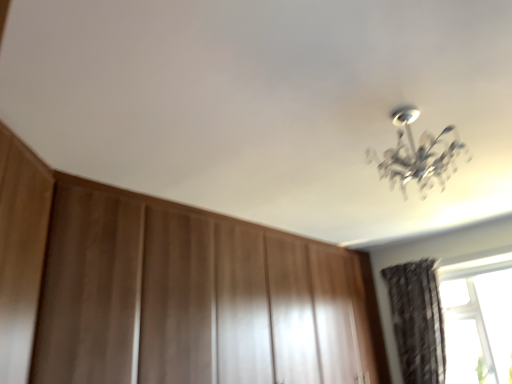
What do you see at coordinates (188, 295) in the screenshot? I see `wooden dresser at center` at bounding box center [188, 295].

The height and width of the screenshot is (384, 512). I want to click on wooden dresser at center, so click(188, 295).

Measure the distance between point (x=423, y=342) and camera.

The depth of point (x=423, y=342) is 11.53 feet.

Image resolution: width=512 pixels, height=384 pixels. Identify the location of dark textured curtain at lower right. 417,320.

What do you see at coordinates (417, 320) in the screenshot? I see `dark textured curtain at lower right` at bounding box center [417, 320].

Identify the location of wooden dresser at center. Image resolution: width=512 pixels, height=384 pixels. (188, 295).

Visually, is dark textured curtain at lower right positioned to the left or to the right of wooden dresser at center?

Based on their positions, dark textured curtain at lower right is located to the right of wooden dresser at center.

In the image, is dark textured curtain at lower right positioned in front of or behind wooden dresser at center?

dark textured curtain at lower right is positioned farther from the viewer than wooden dresser at center.

Is point (406, 271) closer to camera compared to point (47, 250)?

No, (406, 271) is behind (47, 250).

From the image's perspective, which is above, dark textured curtain at lower right or wooden dresser at center?

wooden dresser at center appears higher in the image.

From a real-world perspective, relative to wooden dresser at center, is dark textured curtain at lower right vertically above or below?

dark textured curtain at lower right is below wooden dresser at center.

Which of these two, dark textured curtain at lower right or wooden dresser at center, is wider?

wooden dresser at center.

Does dark textured curtain at lower right have a greater height compared to wooden dresser at center?

Incorrect, the height of dark textured curtain at lower right is not larger of that of wooden dresser at center.

Between dark textured curtain at lower right and wooden dresser at center, which one has larger size?

With larger size is wooden dresser at center.

Choose the correct answer: Is dark textured curtain at lower right inside wooden dresser at center or outside it?

dark textured curtain at lower right is contained in wooden dresser at center.

Is dark textured curtain at lower right positioned far away from wooden dresser at center?

Yes, dark textured curtain at lower right and wooden dresser at center are located far from each other.

Does dark textured curtain at lower right turn towards wooden dresser at center?

Yes, dark textured curtain at lower right faces towards wooden dresser at center.

You are a GUI agent. You are given a task and a screenshot of the screen. Output one action in this format:
    pyautogui.click(x=<x>, y=<y>)
    Task: Click on the dresser that appears above the dark textured curtain at lower right (from a real-world perspective)
    
    Given the screenshot: What is the action you would take?
    pyautogui.click(x=188, y=295)

Between wooden dresser at center and dark textured curtain at lower right, which one appears on the right side from the viewer's perspective?

From the viewer's perspective, dark textured curtain at lower right appears more on the right side.

Between wooden dresser at center and dark textured curtain at lower right, which one is positioned in front?

wooden dresser at center is more forward.

Which is nearer, (245,324) or (442,376)?

Point (245,324).

From the image's perspective, which object appears higher, wooden dresser at center or dark textured curtain at lower right?

wooden dresser at center appears higher in the image.

From a real-world perspective, which object rests below the other?

dark textured curtain at lower right is physically lower.

Considering the relative sizes of wooden dresser at center and dark textured curtain at lower right in the image provided, is wooden dresser at center thinner than dark textured curtain at lower right?

Incorrect, the width of wooden dresser at center is not less than that of dark textured curtain at lower right.

Between wooden dresser at center and dark textured curtain at lower right, which one has more height?

wooden dresser at center.

Considering the sizes of objects wooden dresser at center and dark textured curtain at lower right in the image provided, who is bigger, wooden dresser at center or dark textured curtain at lower right?

With larger size is wooden dresser at center.

Based on the photo, is dark textured curtain at lower right inside wooden dresser at center?

Indeed, dark textured curtain at lower right is located within wooden dresser at center.

Is wooden dresser at center far away from dark textured curtain at lower right?

Yes.

Could you tell me if wooden dresser at center is turned towards dark textured curtain at lower right?

Yes, wooden dresser at center is aimed at dark textured curtain at lower right.

Can you tell me how much wooden dresser at center and dark textured curtain at lower right differ in facing direction?

89.5 degrees separate the facing orientations of wooden dresser at center and dark textured curtain at lower right.

How much distance is there between wooden dresser at center and dark textured curtain at lower right?

They are 1.40 meters apart.

This screenshot has width=512, height=384. I want to click on dresser located above the dark textured curtain at lower right (from the image's perspective), so click(188, 295).

Identify the location of dresser above the dark textured curtain at lower right (from a real-world perspective). (188, 295).

This screenshot has height=384, width=512. In order to click on curtain lying below the wooden dresser at center (from the image's perspective) in this screenshot , I will do click(417, 320).